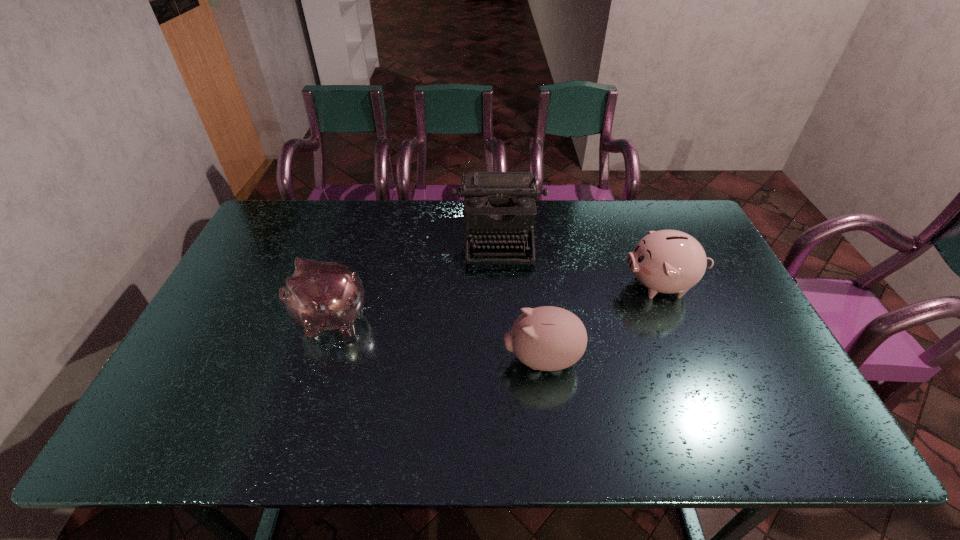
The height and width of the screenshot is (540, 960). I want to click on object that is the closest to the typewriter, so click(666, 261).

In order to click on piggy bank that stands as the closest to the leftmost piggy bank in this screenshot , I will do `click(547, 338)`.

Identify which piggy bank is the second nearest to the typewriter. Please provide its 2D coordinates. Your answer should be formatted as a tuple, i.e. [(x, y)], where the tuple contains the x and y coordinates of a point satisfying the conditions above.

[(321, 296)]

Where is `vacant area in the image that satisfies the following two spatial constraints: 1. on the typing side of the typewriter; 2. on the front facing side of the leftmost object`? vacant area in the image that satisfies the following two spatial constraints: 1. on the typing side of the typewriter; 2. on the front facing side of the leftmost object is located at coordinates (502, 319).

Where is `free location that satisfies the following two spatial constraints: 1. on the typing side of the typewriter; 2. on the right side of the rightmost object`? The width and height of the screenshot is (960, 540). free location that satisfies the following two spatial constraints: 1. on the typing side of the typewriter; 2. on the right side of the rightmost object is located at coordinates (501, 285).

The height and width of the screenshot is (540, 960). What are the coordinates of `free space in the image that satisfies the following two spatial constraints: 1. on the front side of the rightmost object; 2. on the front facing side of the leftmost piggy bank` in the screenshot? It's located at (677, 319).

Locate an element on the screen. The image size is (960, 540). vacant space that satisfies the following two spatial constraints: 1. on the typing side of the typewriter; 2. on the front facing side of the leftmost piggy bank is located at coordinates (502, 319).

Locate an element on the screen. This screenshot has width=960, height=540. vacant area that satisfies the following two spatial constraints: 1. on the front side of the rightmost object; 2. on the front facing side of the leftmost piggy bank is located at coordinates (677, 319).